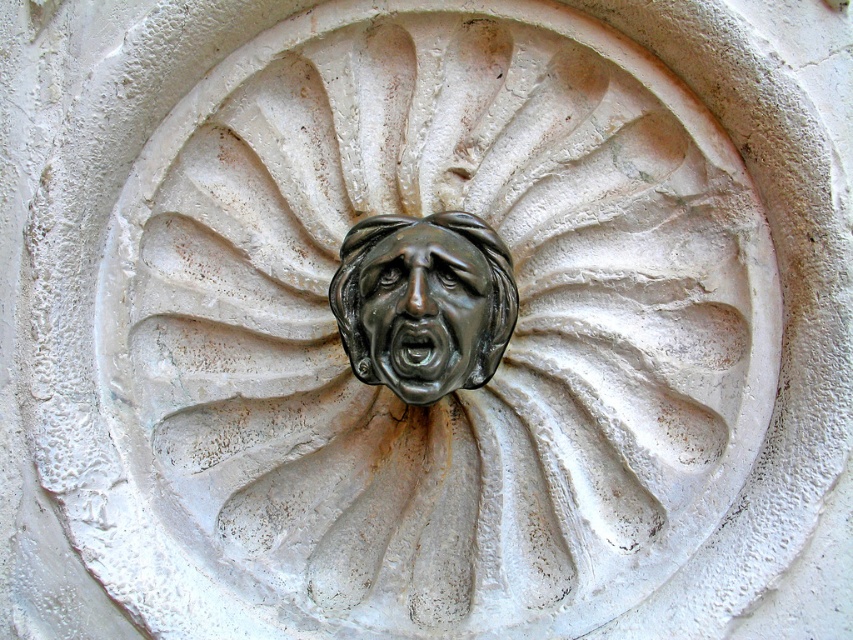
You are an art conservator examining the carved stone relief. You notice two points labeled as point 1 at coordinates (432, 218) and point 2 at coordinates (451, 284). Based on the carving details, which point is closer to the viewer?

Point 2 at coordinates (451, 284) is closer to the viewer because the Objects Description states that point 1 is behind point 2.